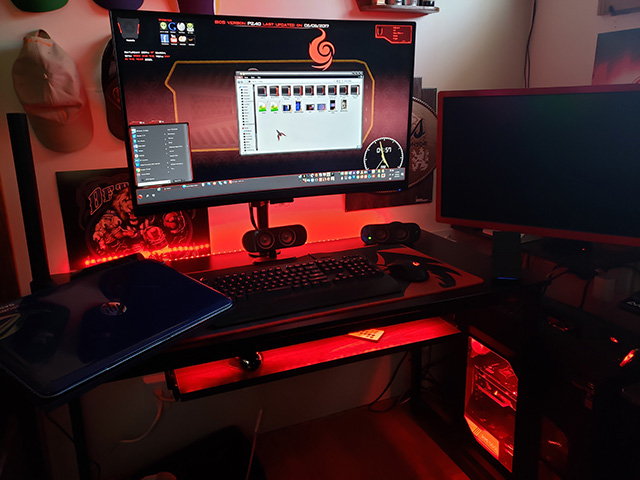
Locate an element on the screen. The height and width of the screenshot is (480, 640). webcam is located at coordinates (393, 232).